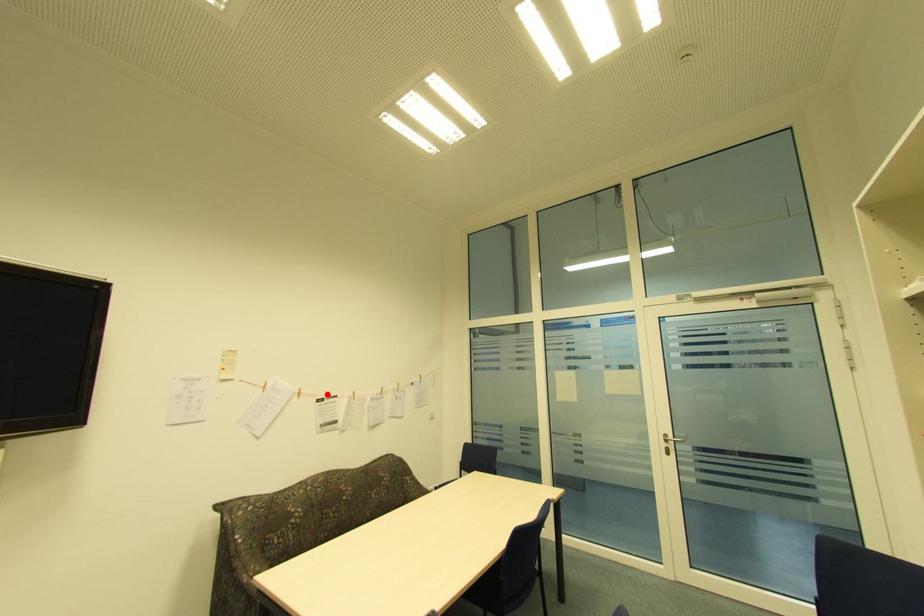
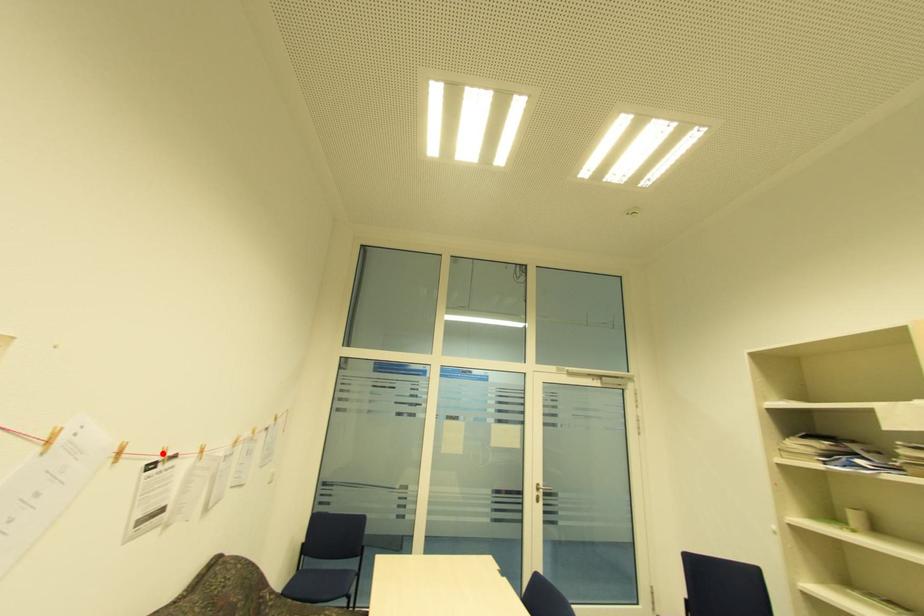
I am providing you with two images of the same scene from different viewpoints. A red point is marked on the first image and another point is marked on the second image. Is the red point in image1 aligned with the point shown in image2?

Yes